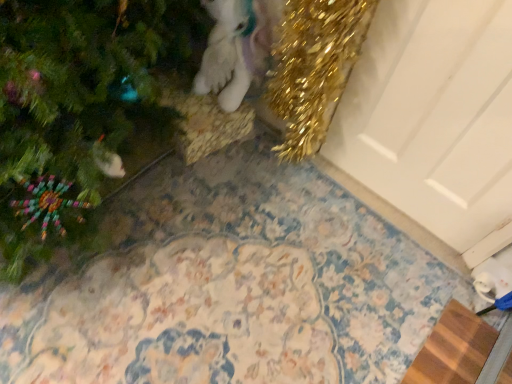
Question: Considering the positions of point (473, 326) and point (411, 51), is point (473, 326) closer or farther from the camera than point (411, 51)?

Choices:
 (A) closer
 (B) farther

Answer: (B)

Question: Would you say brown woven mat at lower right is inside or outside white matte door at upper right?

Choices:
 (A) outside
 (B) inside

Answer: (A)

Question: Which object is the farthest from the green matte christmas tree at upper left?

Choices:
 (A) white matte door at upper right
 (B) brown woven mat at lower right
 (C) white plush unicorn at upper center

Answer: (B)

Question: Which of these objects is positioned closest to the brown woven mat at lower right?

Choices:
 (A) green matte christmas tree at upper left
 (B) white matte door at upper right
 (C) white plush unicorn at upper center

Answer: (B)